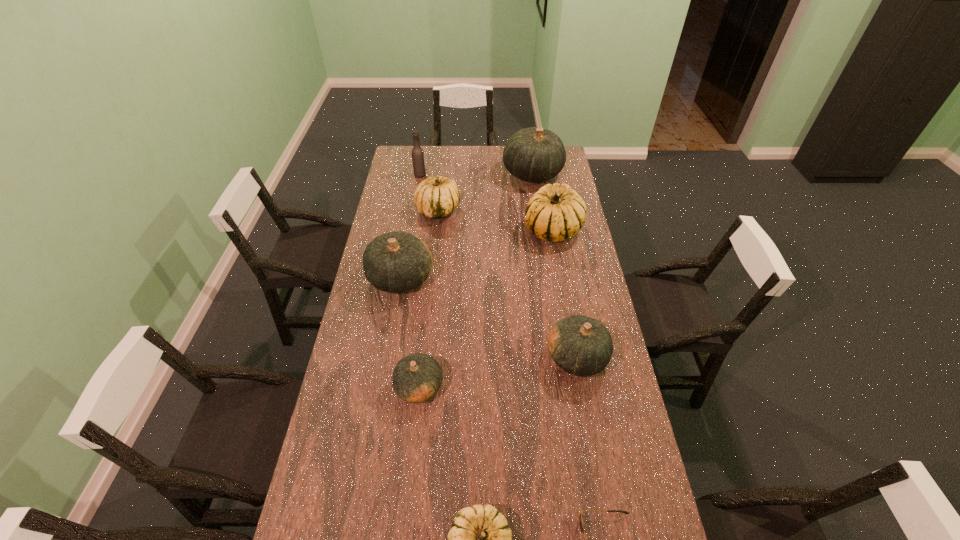
Where is `gourd that is the fourth closest to the biggest white gourd`? gourd that is the fourth closest to the biggest white gourd is located at coordinates [580, 345].

Locate an element on the screen. Image resolution: width=960 pixels, height=540 pixels. gourd identified as the second closest to the third biggest orange gourd is located at coordinates (480, 539).

Identify which orange gourd is the nearest to the smallest orange gourd. Please provide its 2D coordinates. Your answer should be formatted as a tuple, i.e. [(x, y)], where the tuple contains the x and y coordinates of a point satisfying the conditions above.

[(396, 262)]

Identify which orange gourd is the third nearest to the leftmost white gourd. Please provide its 2D coordinates. Your answer should be formatted as a tuple, i.e. [(x, y)], where the tuple contains the x and y coordinates of a point satisfying the conditions above.

[(580, 345)]

The width and height of the screenshot is (960, 540). Identify the location of white gourd that stands as the second closest to the sunglasses. [x=556, y=212].

This screenshot has width=960, height=540. Find the location of `the second closest white gourd to the rightmost white gourd`. the second closest white gourd to the rightmost white gourd is located at coordinates (480, 539).

The height and width of the screenshot is (540, 960). I want to click on free space that satisfies the following two spatial constraints: 1. on the front side of the rightmost white gourd; 2. on the right side of the third biggest orange gourd, so click(576, 357).

Where is `free point that satisfies the following two spatial constraints: 1. on the front side of the leftmost white gourd; 2. on the left side of the rightmost white gourd`? free point that satisfies the following two spatial constraints: 1. on the front side of the leftmost white gourd; 2. on the left side of the rightmost white gourd is located at coordinates (436, 230).

This screenshot has width=960, height=540. I want to click on vacant region that satisfies the following two spatial constraints: 1. on the back side of the biggest white gourd; 2. on the label of the beer bottle, so click(543, 175).

I want to click on vacant space that satisfies the following two spatial constraints: 1. on the label of the rightmost white gourd; 2. on the left side of the beer bottle, so click(411, 230).